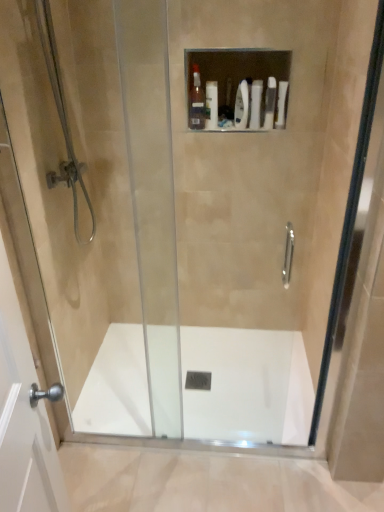
The width and height of the screenshot is (384, 512). I want to click on vacant area that lies to the right of clear glass shower door at left, so click(165, 450).